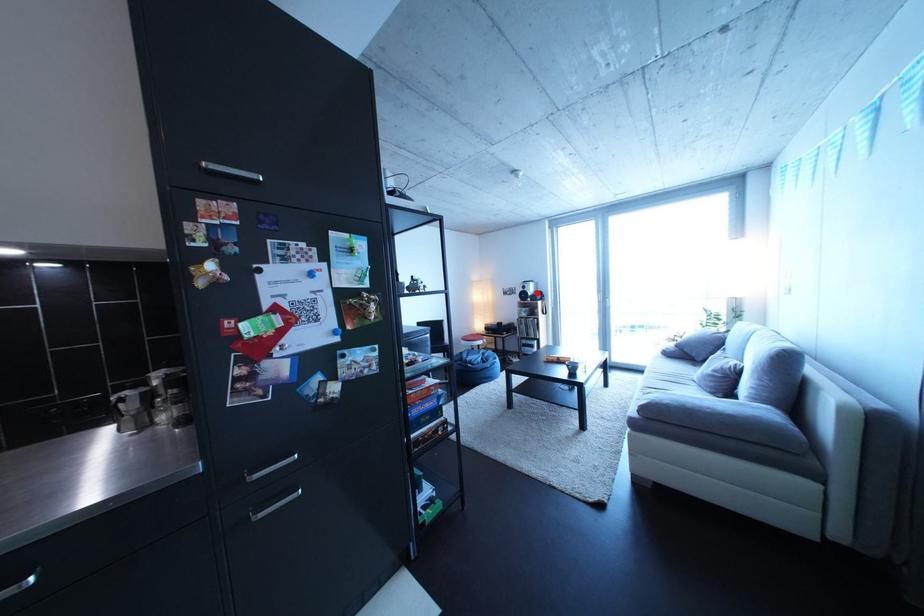
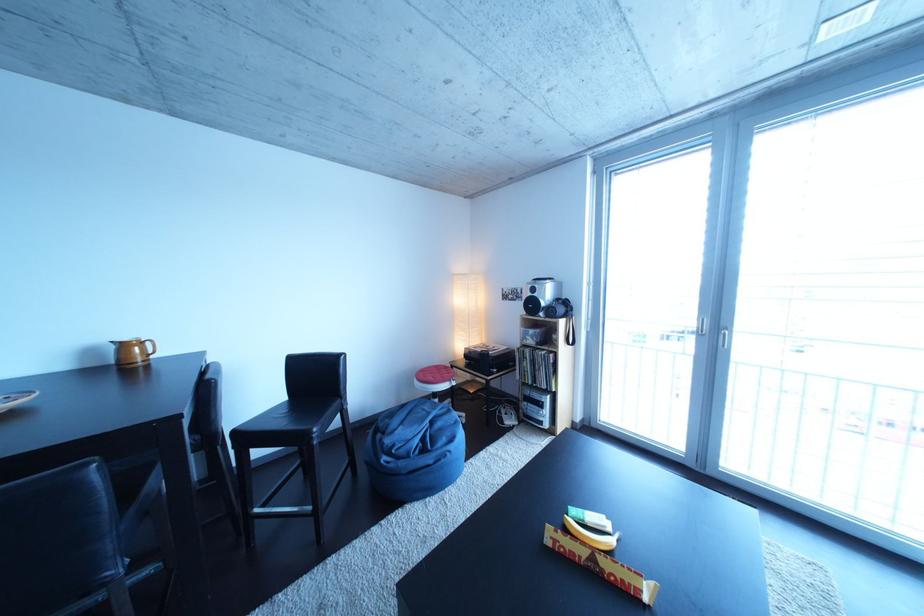
Where in the second image is the point corresponding to the highlighted location from the first image?

(545, 296)